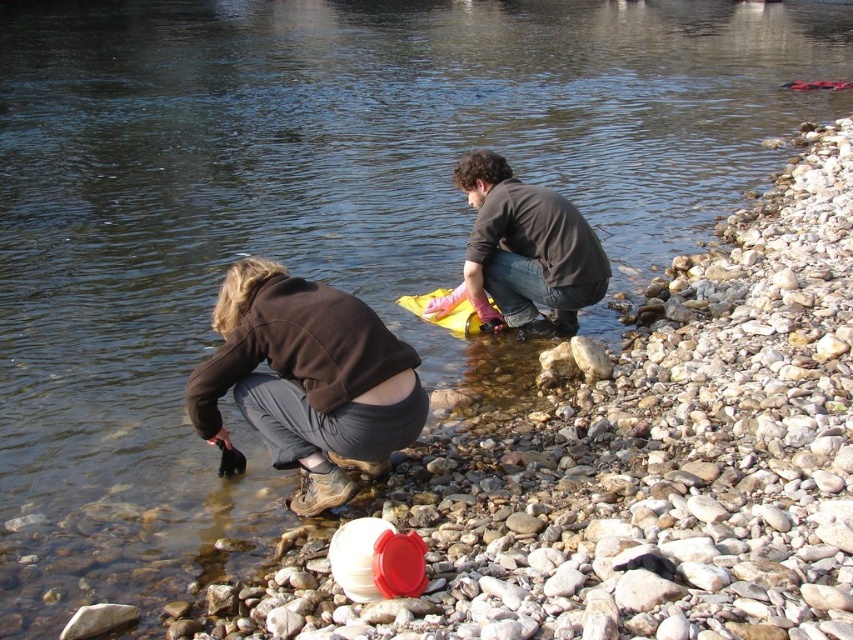
Is brown leather boots at lower left to the left of dark brown shirt at center from the viewer's perspective?

Indeed, brown leather boots at lower left is positioned on the left side of dark brown shirt at center.

Based on the photo, which is more to the left, brown leather boots at lower left or dark brown shirt at center?

From the viewer's perspective, brown leather boots at lower left appears more on the left side.

Describe the element at coordinates (306, 378) in the screenshot. I see `brown leather boots at lower left` at that location.

Identify the location of brown leather boots at lower left. This screenshot has width=853, height=640. (306, 378).